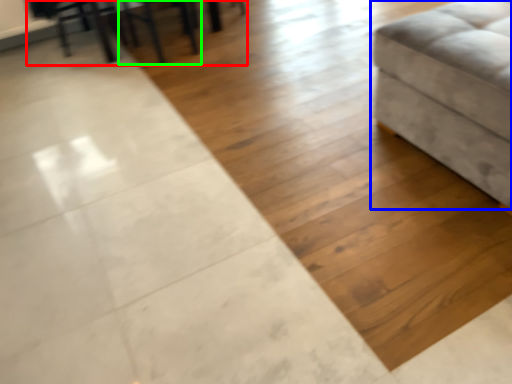
Question: Considering the real-world distances, which object is closest to table (highlighted by a red box)? furniture (highlighted by a blue box) or chair (highlighted by a green box).

Choices:
 (A) furniture
 (B) chair

Answer: (B)